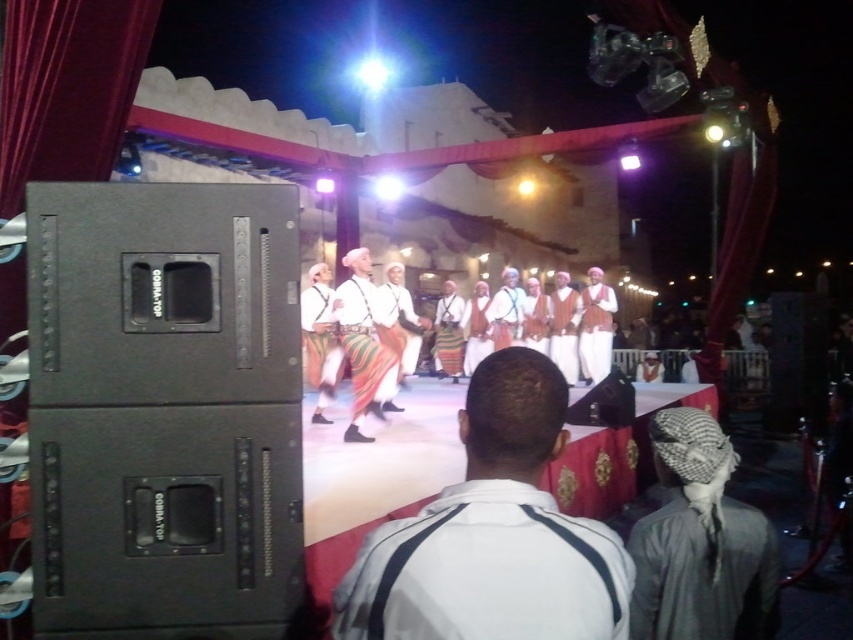
Based on the photo, is white fabric at center to the right of multicolored fabric pants at center from the viewer's perspective?

Yes, white fabric at center is to the right of multicolored fabric pants at center.

From the picture: Who is lower down, white fabric at center or multicolored fabric pants at center?

white fabric at center is below.

Is point (555, 589) in front of point (357, 280)?

Yes, it is in front of point (357, 280).

Locate an element on the screen. Image resolution: width=853 pixels, height=640 pixels. white fabric at center is located at coordinates (492, 534).

Is white fabric at center positioned before dark gray fabric headscarf at center?

That is True.

Which is in front, point (474, 449) or point (651, 422)?

Point (474, 449)

Image resolution: width=853 pixels, height=640 pixels. I want to click on white fabric at center, so click(x=492, y=534).

Does dark gray fabric headscarf at center have a smaller size compared to multicolored fabric pants at center?

Indeed, dark gray fabric headscarf at center has a smaller size compared to multicolored fabric pants at center.

Is dark gray fabric headscarf at center bigger than multicolored fabric pants at center?

No.

Is point (756, 582) behind point (355, 285)?

No, it is in front of (355, 285).

The image size is (853, 640). What are the coordinates of `dark gray fabric headscarf at center` in the screenshot? It's located at (700, 541).